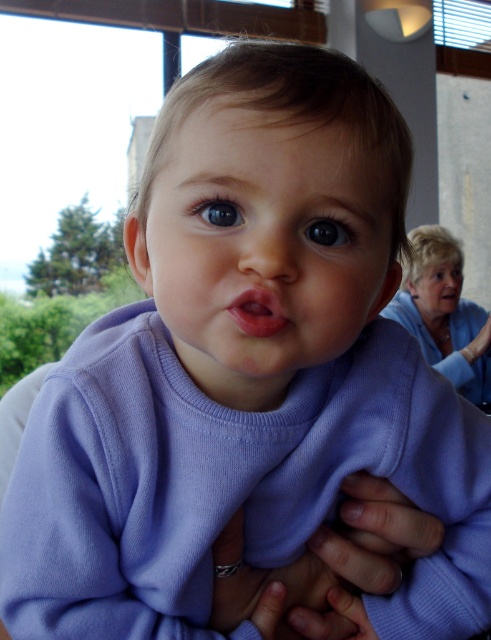
Question: Is purple soft fabric baby at center behind pink glossy lips at center?

Choices:
 (A) yes
 (B) no

Answer: (B)

Question: Among these points, which one is nearest to the camera?

Choices:
 (A) (249, 333)
 (B) (446, 296)

Answer: (A)

Question: Estimate the real-world distances between objects in this image. Which object is closer to the smooth skin face at right?

Choices:
 (A) pink glossy lips at center
 (B) purple soft fabric baby at center

Answer: (B)

Question: Can you confirm if purple soft fabric baby at center is positioned to the left of smooth skin face at right?

Choices:
 (A) no
 (B) yes

Answer: (B)

Question: Does purple soft fabric baby at center appear under smooth skin face at right?

Choices:
 (A) no
 (B) yes

Answer: (B)

Question: Which of the following is the farthest from the observer?

Choices:
 (A) smooth skin face at right
 (B) purple soft fabric baby at center
 (C) pink glossy lips at center

Answer: (A)